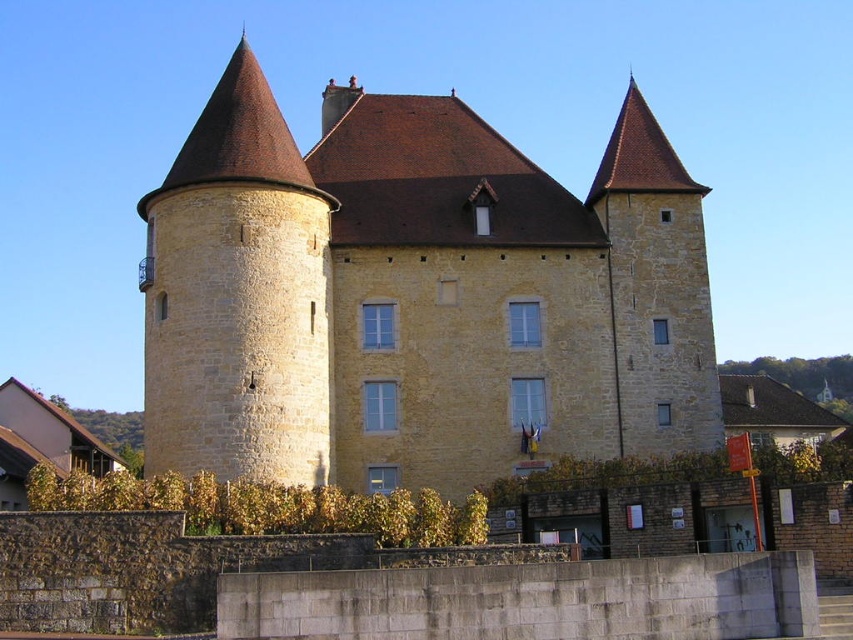
Question: Which of the following is the closest to the observer?

Choices:
 (A) yellow stone tower at left
 (B) yellow stone castle at center

Answer: (A)

Question: Does yellow stone castle at center have a lesser width compared to yellow stone tower at left?

Choices:
 (A) no
 (B) yes

Answer: (A)

Question: Where is yellow stone castle at center located in relation to yellow stone tower at left in the image?

Choices:
 (A) right
 (B) left

Answer: (A)

Question: Does yellow stone castle at center appear over yellow stone tower at left?

Choices:
 (A) yes
 (B) no

Answer: (B)